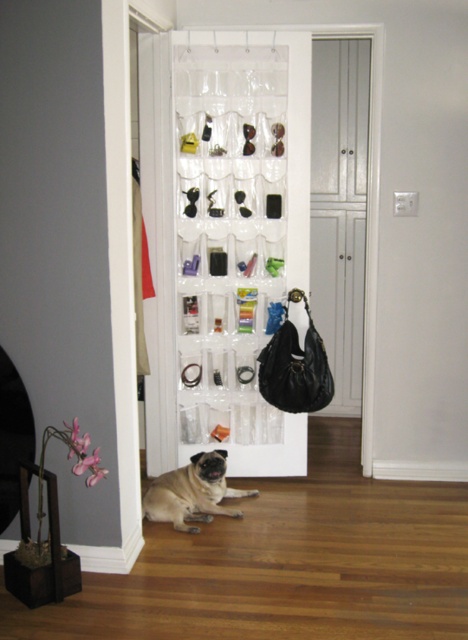
Question: Among these objects, which one is farthest from the camera?

Choices:
 (A) clear plastic organizer at center
 (B) light brown fur at center
 (C) black leather handbag at center

Answer: (C)

Question: Is black leather handbag at center thinner than light brown fur at center?

Choices:
 (A) yes
 (B) no

Answer: (A)

Question: Does white glossy cabinet at center come in front of black leather handbag at center?

Choices:
 (A) yes
 (B) no

Answer: (B)

Question: Which object is the closest to the light brown fur at center?

Choices:
 (A) clear plastic organizer at center
 (B) black leather handbag at center

Answer: (B)

Question: Which point appears farthest from the camera in this image?

Choices:
 (A) (257, 177)
 (B) (292, 328)
 (C) (229, 493)

Answer: (A)

Question: Is white glossy cabinet at center to the left of light brown fur at center from the viewer's perspective?

Choices:
 (A) no
 (B) yes

Answer: (A)